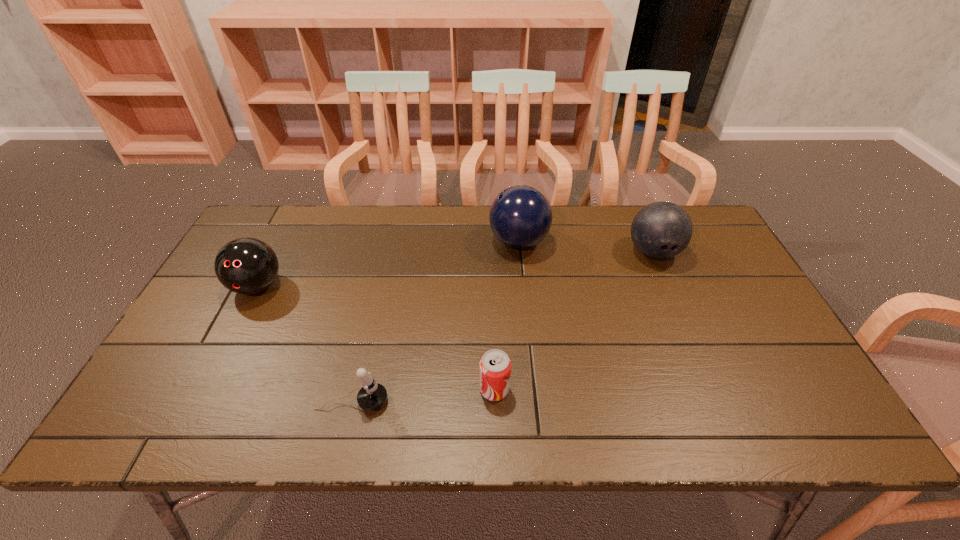
Identify the location of free space between the second bowling ball from right to left and the rightmost object. [586, 247].

Locate an element on the screen. This screenshot has height=540, width=960. free space that is in between the rightmost object and the leftmost object is located at coordinates (455, 269).

Locate an element on the screen. This screenshot has width=960, height=540. vacant space that is in between the leftmost object and the second bowling ball from left to right is located at coordinates (388, 264).

I want to click on the second closest object to the soda can, so click(x=520, y=216).

Choose which object is the nearest neighbor to the second bowling ball from left to right. Please provide its 2D coordinates. Your answer should be formatted as a tuple, i.e. [(x, y)], where the tuple contains the x and y coordinates of a point satisfying the conditions above.

[(660, 230)]

Identify which bowling ball is the second closest to the soda can. Please provide its 2D coordinates. Your answer should be formatted as a tuple, i.e. [(x, y)], where the tuple contains the x and y coordinates of a point satisfying the conditions above.

[(660, 230)]

Where is `bowling ball that is the third closest to the microphone`? bowling ball that is the third closest to the microphone is located at coordinates (660, 230).

The image size is (960, 540). Identify the location of free space that satisfies the following two spatial constraints: 1. on the surface of the leftmost bowling ball near the finger holes; 2. on the right side of the soda can. (204, 389).

Where is `free space that satisfies the following two spatial constraints: 1. on the surface of the soda can near the finger holes; 2. on the left side of the leftmost bowling ball`? The height and width of the screenshot is (540, 960). free space that satisfies the following two spatial constraints: 1. on the surface of the soda can near the finger holes; 2. on the left side of the leftmost bowling ball is located at coordinates (204, 389).

Find the location of a particular element. This screenshot has height=540, width=960. free space that satisfies the following two spatial constraints: 1. on the surface of the microphone near the finger holes; 2. on the right side of the leftmost object is located at coordinates (198, 402).